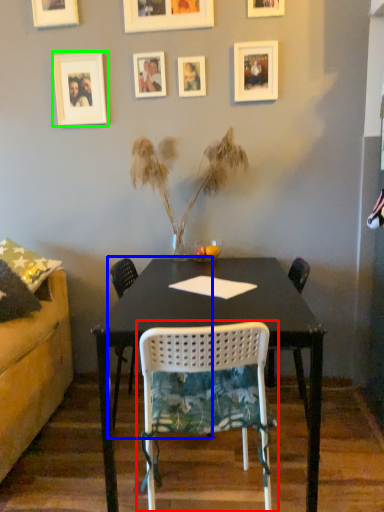
Question: Considering the real-world distances, which object is farthest from chair (highlighted by a red box)? chair (highlighted by a blue box) or picture frame (highlighted by a green box)?

Choices:
 (A) chair
 (B) picture frame

Answer: (B)